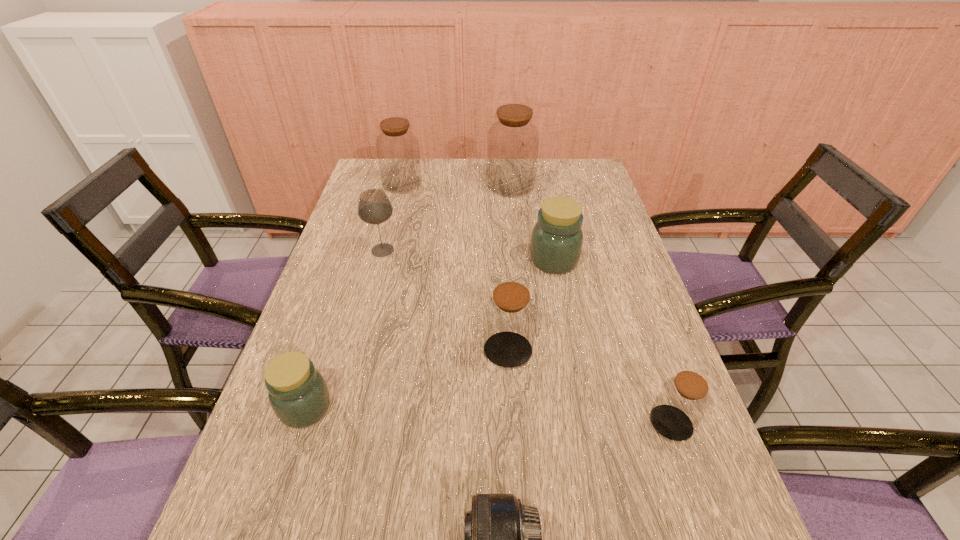
This screenshot has width=960, height=540. Find the location of `free space between the tallest jar and the wineglass`. free space between the tallest jar and the wineglass is located at coordinates (446, 218).

Identify the location of vacant area between the nearer green jar and the gray wineglass. (344, 329).

Locate an element on the screen. This screenshot has height=540, width=960. unoccupied area between the gray wineglass and the seventh shortest object is located at coordinates (393, 217).

Select which object is the fourth closest to the third nearest jar. Please provide its 2D coordinates. Your answer should be formatted as a tuple, i.e. [(x, y)], where the tuple contains the x and y coordinates of a point satisfying the conditions above.

[(298, 394)]

Locate an element on the screen. The width and height of the screenshot is (960, 540). object identified as the second closest to the third nearest jar is located at coordinates (683, 400).

The height and width of the screenshot is (540, 960). What are the coordinates of `the fourth closest jar to the fifth shortest jar` in the screenshot? It's located at (298, 394).

Locate which jar is the fifth closest to the third farthest brown jar. Please provide its 2D coordinates. Your answer should be formatted as a tuple, i.e. [(x, y)], where the tuple contains the x and y coordinates of a point satisfying the conditions above.

[(397, 147)]

Where is `brown jar object that ranks as the second closest to the nearer green jar`? Image resolution: width=960 pixels, height=540 pixels. brown jar object that ranks as the second closest to the nearer green jar is located at coordinates (683, 400).

This screenshot has width=960, height=540. I want to click on brown jar that is the second closest to the third farthest brown jar, so click(x=513, y=141).

This screenshot has width=960, height=540. I want to click on vacant point that satisfies the following two spatial constraints: 1. on the front side of the tallest object; 2. on the left side of the third farthest jar, so click(518, 260).